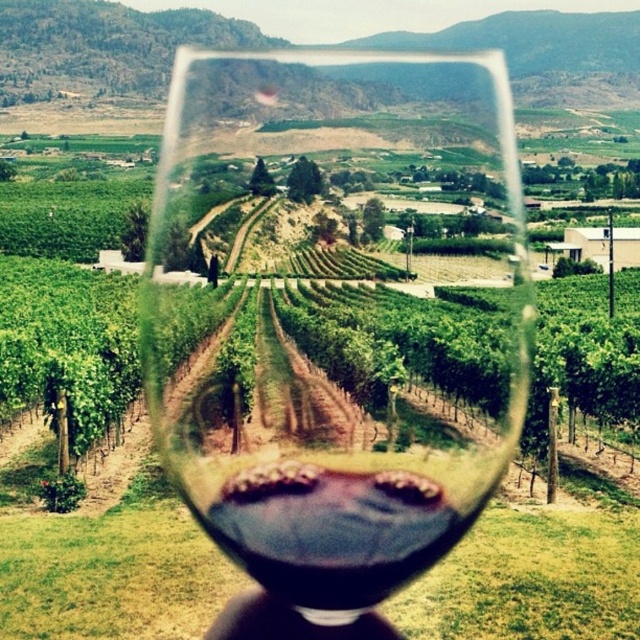
Question: Can you confirm if transparent glass at center is bigger than black matte hand at lower center?

Choices:
 (A) no
 (B) yes

Answer: (B)

Question: Which point is closer to the camera?

Choices:
 (A) transparent glass at center
 (B) dark red liquid at center

Answer: (B)

Question: Based on their relative distances, which object is farther from the black matte hand at lower center?

Choices:
 (A) dark red liquid at center
 (B) transparent glass at center

Answer: (B)

Question: Which object is the closest to the black matte hand at lower center?

Choices:
 (A) transparent glass at center
 (B) dark red liquid at center

Answer: (B)

Question: Observing the image, what is the correct spatial positioning of dark red liquid at center in reference to black matte hand at lower center?

Choices:
 (A) above
 (B) below

Answer: (A)

Question: Is transparent glass at center thinner than dark red liquid at center?

Choices:
 (A) yes
 (B) no

Answer: (A)